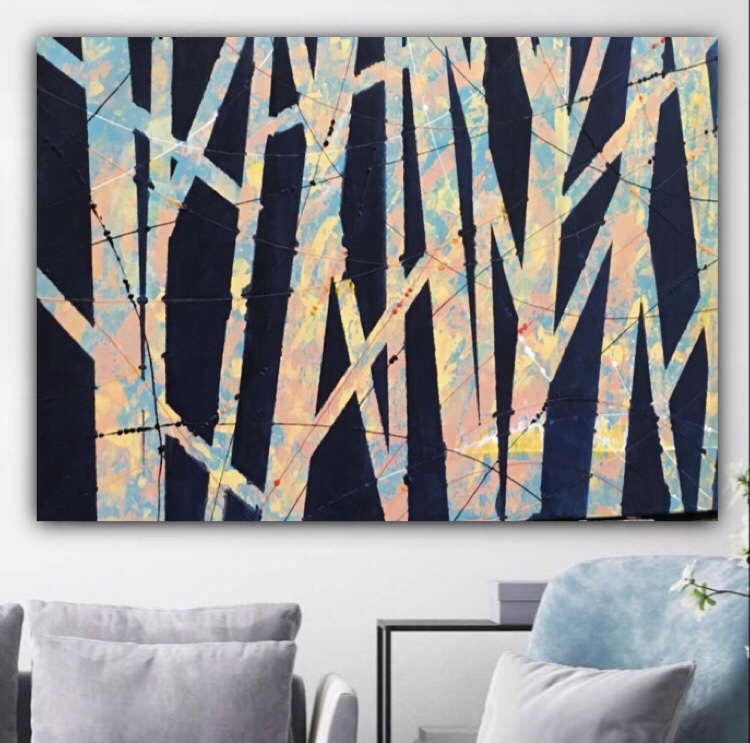
This screenshot has height=743, width=750. Identify the location of box. (524, 597).